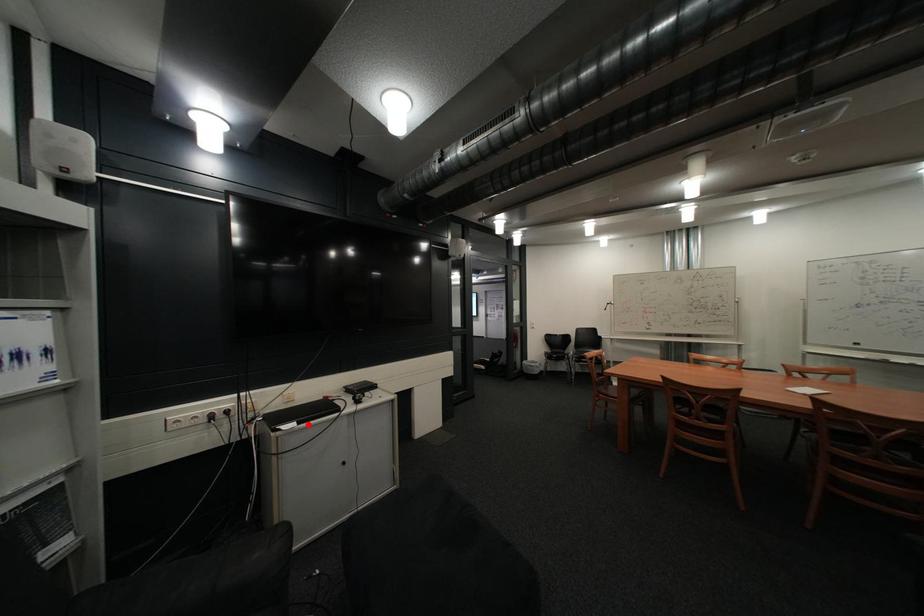
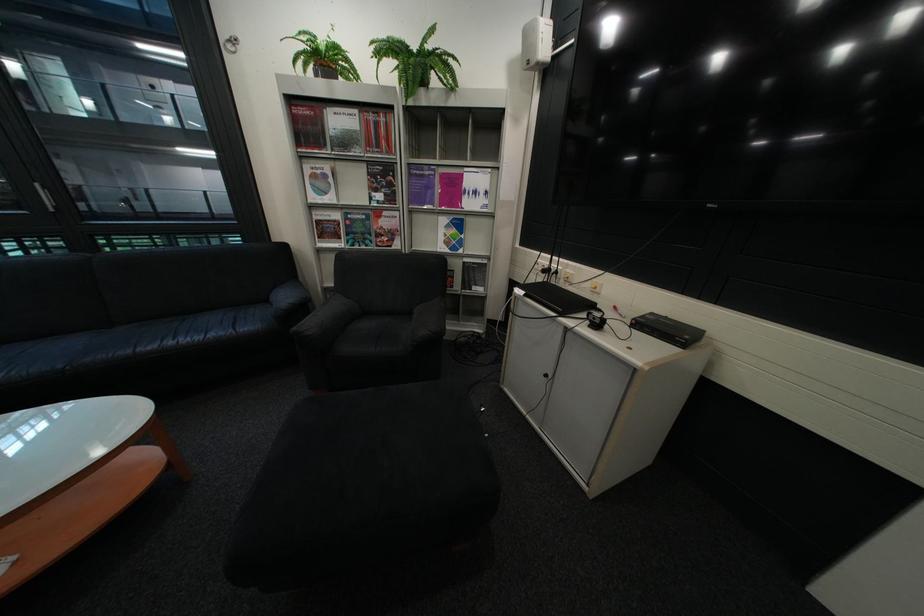
Where in the second image is the point corresponding to the highlighted location from the first image?

(538, 293)